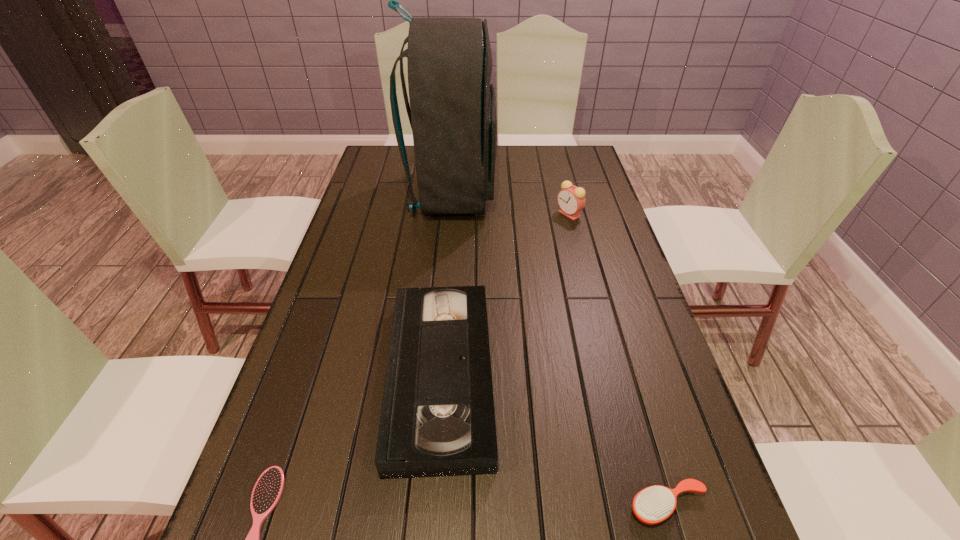
I want to click on vacant region that satisfies the following two spatial constraints: 1. on the back side of the second shortest object; 2. on the face of the fourth shortest object, so click(x=582, y=214).

Find the location of a particular element. free location that satisfies the following two spatial constraints: 1. on the front side of the videotape; 2. on the left side of the taller hairbrush is located at coordinates (431, 505).